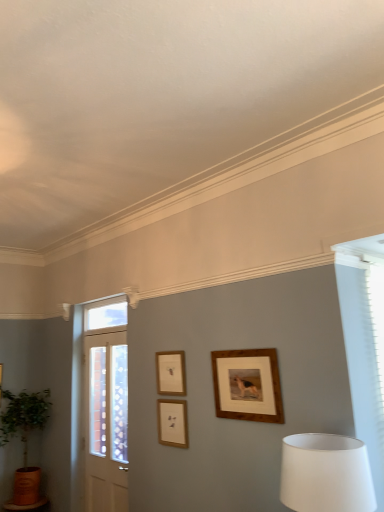
Question: Is wooden picture frame at center, the second picture frame viewed from the left, to the right of clear glass window at upper center from the viewer's perspective?

Choices:
 (A) yes
 (B) no

Answer: (A)

Question: Is wooden picture frame at center, the second picture frame viewed from the left, positioned in front of clear glass window at upper center?

Choices:
 (A) no
 (B) yes

Answer: (B)

Question: Considering the relative positions of wooden picture frame at center, the second picture frame viewed from the left, and clear glass window at upper center in the image provided, is wooden picture frame at center, the second picture frame viewed from the left, behind clear glass window at upper center?

Choices:
 (A) yes
 (B) no

Answer: (B)

Question: Is wooden picture frame at center, the second picture frame viewed from the left, wider than clear glass window at upper center?

Choices:
 (A) no
 (B) yes

Answer: (A)

Question: Would you say clear glass window at upper center is part of wooden picture frame at center, the 2th picture frame viewed from the right,'s contents?

Choices:
 (A) no
 (B) yes

Answer: (A)

Question: Does wooden picture frame at center, the 2th picture frame viewed from the right, have a greater height compared to clear glass window at upper center?

Choices:
 (A) no
 (B) yes

Answer: (B)

Question: Considering the relative positions of white wood door at left and white fabric lampshade at lower right in the image provided, is white wood door at left to the left of white fabric lampshade at lower right from the viewer's perspective?

Choices:
 (A) yes
 (B) no

Answer: (A)

Question: Does white wood door at left have a lesser width compared to white fabric lampshade at lower right?

Choices:
 (A) yes
 (B) no

Answer: (A)

Question: Considering the relative sizes of white wood door at left and white fabric lampshade at lower right in the image provided, is white wood door at left smaller than white fabric lampshade at lower right?

Choices:
 (A) no
 (B) yes

Answer: (B)

Question: Are white wood door at left and white fabric lampshade at lower right far apart?

Choices:
 (A) yes
 (B) no

Answer: (A)

Question: From the image's perspective, does white wood door at left appear lower than white fabric lampshade at lower right?

Choices:
 (A) no
 (B) yes

Answer: (B)

Question: Could you tell me if white wood door at left is turned towards white fabric lampshade at lower right?

Choices:
 (A) no
 (B) yes

Answer: (A)

Question: Is green leafy plant in terracotta pot at lower left placed right next to white wood door at left?

Choices:
 (A) yes
 (B) no

Answer: (B)